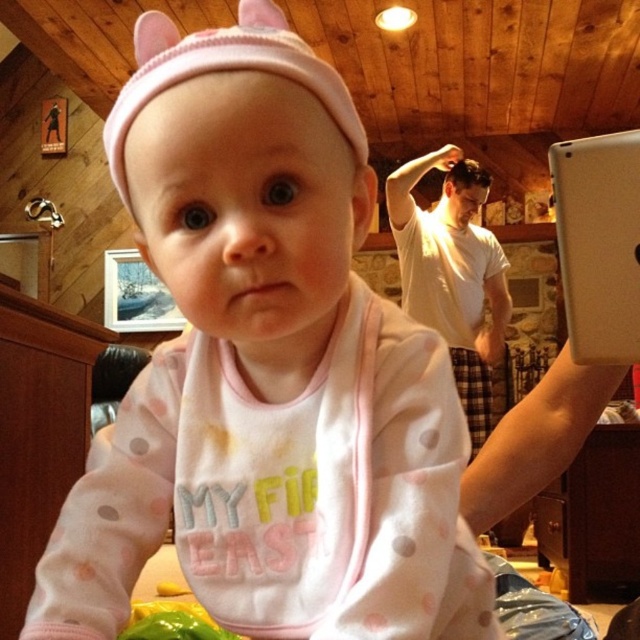
In the scene shown: Is pink fabric bib at center below pink knit hat at upper center?

Indeed, pink fabric bib at center is positioned under pink knit hat at upper center.

Does pink fabric bib at center appear on the left side of pink knit hat at upper center?

No, pink fabric bib at center is not to the left of pink knit hat at upper center.

You are a GUI agent. You are given a task and a screenshot of the screen. Output one action in this format:
    pyautogui.click(x=<x>, y=<y>)
    Task: Click on the pink fabric bib at center
    
    Given the screenshot: What is the action you would take?
    pyautogui.click(x=275, y=481)

Between pink fabric bib at center and white matte tablet at upper right, which one appears on the left side from the viewer's perspective?

pink fabric bib at center is more to the left.

Can you confirm if pink fabric bib at center is wider than white matte tablet at upper right?

Indeed, pink fabric bib at center has a greater width compared to white matte tablet at upper right.

Find the location of a particular element. pink fabric bib at center is located at coordinates (275, 481).

Is point (625, 205) in front of point (124, 96)?

No, it is behind (124, 96).

Between white matte tablet at upper right and pink knit hat at upper center, which one appears on the left side from the viewer's perspective?

pink knit hat at upper center

Does point (588, 154) lie in front of point (259, 26)?

No, (588, 154) is behind (259, 26).

Identify the location of white matte tablet at upper right. (598, 243).